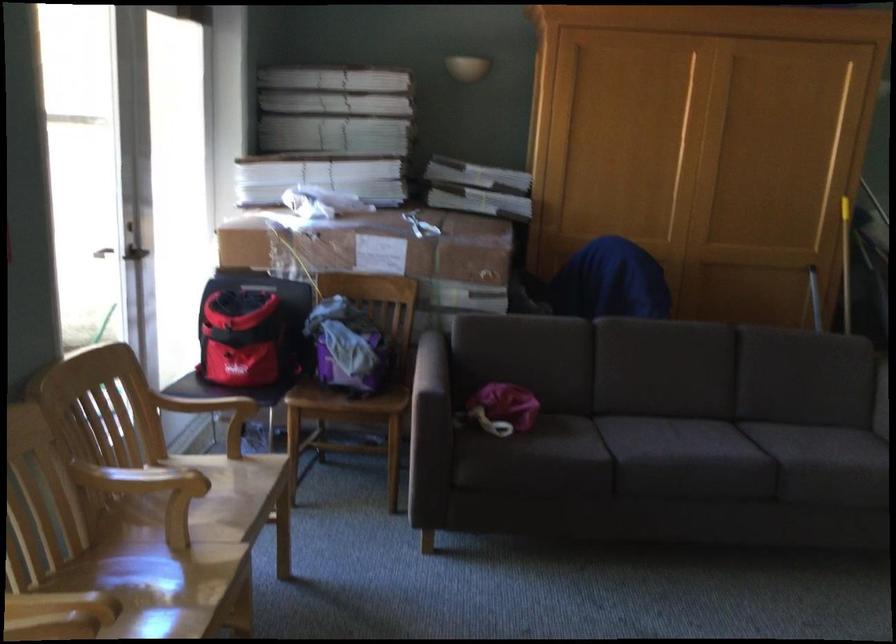
Where is `cardboard box`? This screenshot has width=896, height=644. cardboard box is located at coordinates (371, 245).